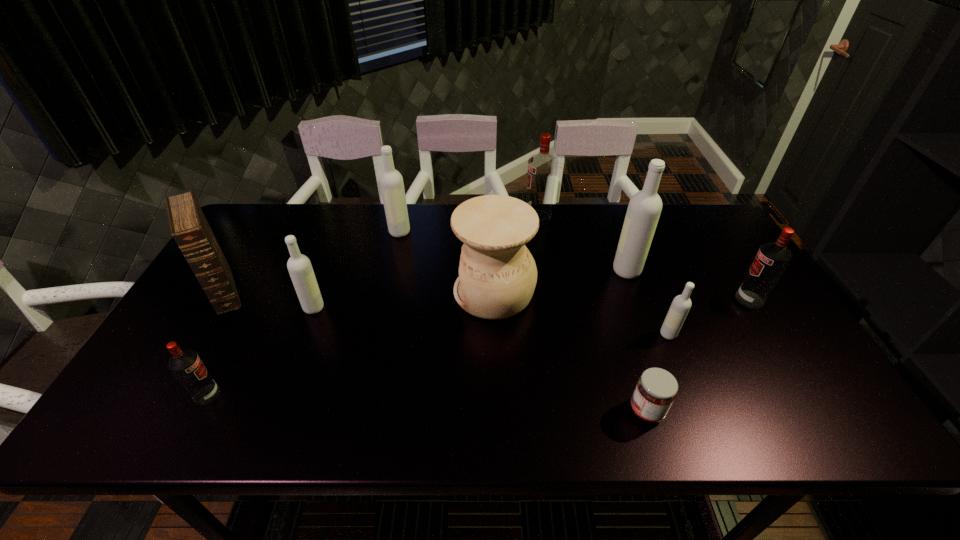
At what (x,y) coordinates should I click in order to perform the action: click on the rightmost red vodka. Please return your answer as a coordinate pair (x, y). The image size is (960, 540). Looking at the image, I should click on (772, 259).

Identify the location of the second biggest red vodka. This screenshot has height=540, width=960. (772, 259).

At what (x,y) coordinates should I click in order to perform the action: click on the leftmost vodka. Please return your answer as a coordinate pair (x, y). Image resolution: width=960 pixels, height=540 pixels. Looking at the image, I should click on (186, 365).

Identify the location of the leftmost red vodka. The height and width of the screenshot is (540, 960). (186, 365).

Identify the location of the second nearest vodka. The width and height of the screenshot is (960, 540). (681, 304).

Locate an element on the screen. Image resolution: width=960 pixels, height=540 pixels. the smallest white vodka is located at coordinates (x=681, y=304).

You are a GUI agent. You are given a task and a screenshot of the screen. Output one action in this format:
    pyautogui.click(x=<x>, y=<y>)
    Task: Click on the red jam
    The image size is (960, 540).
    Given the screenshot: What is the action you would take?
    pyautogui.click(x=656, y=389)

Image resolution: width=960 pixels, height=540 pixels. Identify the location of the shortest object. (656, 389).

This screenshot has width=960, height=540. I want to click on blank space located on the front of the tallest object, so click(663, 373).

Where is `free spot located on the front label of the fourth vodka from left to right`? The height and width of the screenshot is (540, 960). free spot located on the front label of the fourth vodka from left to right is located at coordinates tap(442, 218).